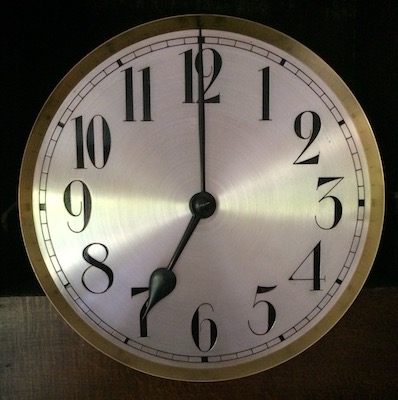
You are a GUI agent. You are given a task and a screenshot of the screen. Output one action in this format:
    pyautogui.click(x=<x>, y=<y>)
    Task: Click on the dark spots on the gold edging of clock
    Image resolution: width=398 pixels, height=400 pixels.
    Given the screenshot: What is the action you would take?
    pyautogui.click(x=216, y=18)